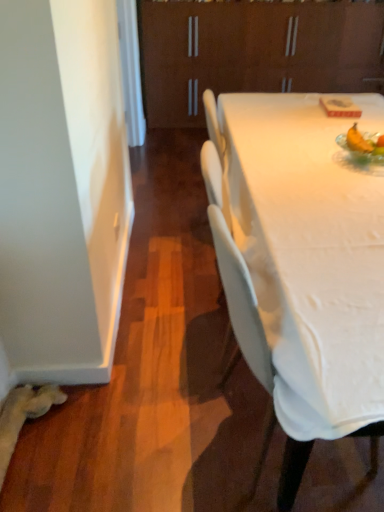
Question: Are translucent glass bowl at upper right and brown matte cabinet at upper center located far from each other?

Choices:
 (A) yes
 (B) no

Answer: (A)

Question: From a real-world perspective, is translucent glass bowl at upper right located higher than brown matte cabinet at upper center?

Choices:
 (A) yes
 (B) no

Answer: (A)

Question: Is translucent glass bowl at upper right positioned with its back to brown matte cabinet at upper center?

Choices:
 (A) yes
 (B) no

Answer: (B)

Question: Is brown matte cabinet at upper center completely or partially inside translucent glass bowl at upper right?

Choices:
 (A) yes
 (B) no

Answer: (B)

Question: Does translucent glass bowl at upper right turn towards brown matte cabinet at upper center?

Choices:
 (A) yes
 (B) no

Answer: (A)

Question: Does translucent glass bowl at upper right have a lesser width compared to brown matte cabinet at upper center?

Choices:
 (A) no
 (B) yes

Answer: (B)

Question: Is brown matte cabinet at upper center with translucent glass bowl at upper right?

Choices:
 (A) no
 (B) yes

Answer: (A)

Question: From a real-world perspective, does brown matte cabinet at upper center stand above translucent glass bowl at upper right?

Choices:
 (A) no
 (B) yes

Answer: (A)

Question: Is brown matte cabinet at upper center in front of translucent glass bowl at upper right?

Choices:
 (A) yes
 (B) no

Answer: (B)

Question: Is brown matte cabinet at upper center located outside translucent glass bowl at upper right?

Choices:
 (A) yes
 (B) no

Answer: (A)

Question: From the image's perspective, would you say brown matte cabinet at upper center is positioned over translucent glass bowl at upper right?

Choices:
 (A) no
 (B) yes

Answer: (B)

Question: Can you confirm if brown matte cabinet at upper center is positioned to the left of translucent glass bowl at upper right?

Choices:
 (A) yes
 (B) no

Answer: (B)

Question: Is white plastic chair at center smaller than brown matte cabinet at upper center?

Choices:
 (A) yes
 (B) no

Answer: (A)